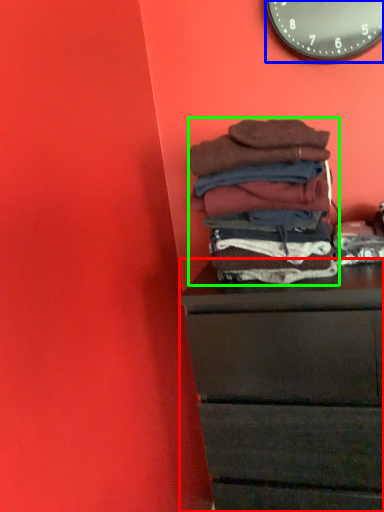
Question: Which is farther away from chest of drawers (highlighted by a red box)? wall clock (highlighted by a blue box) or material (highlighted by a green box)?

Choices:
 (A) wall clock
 (B) material

Answer: (A)